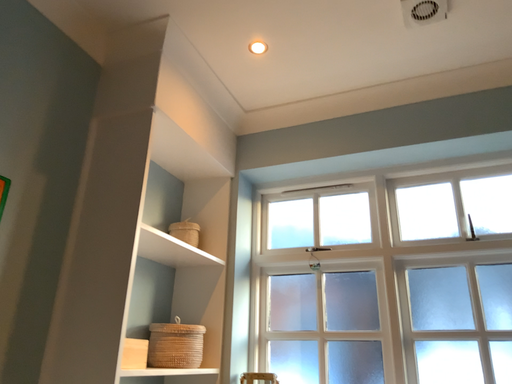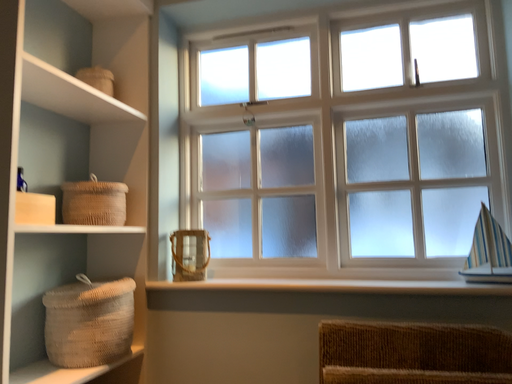
Question: Which way did the camera rotate in the video?

Choices:
 (A) rotated left
 (B) rotated right

Answer: (B)